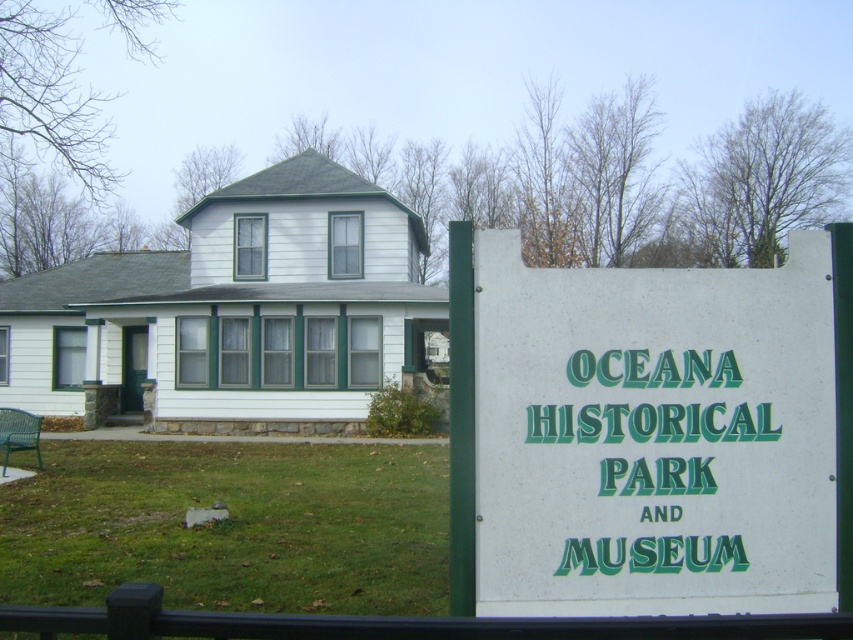
Who is more distant from viewer, (578, 348) or (117, 512)?

The point (117, 512) is behind.

Where is `white plastic sign at center`? This screenshot has height=640, width=853. white plastic sign at center is located at coordinates (657, 436).

Is point (709, 552) in front of point (292, 534)?

Yes, point (709, 552) is in front of point (292, 534).

At what (x,y) coordinates should I click in order to perform the action: click on white plastic sign at center. Please return your answer as a coordinate pair (x, y). Looking at the image, I should click on (657, 436).